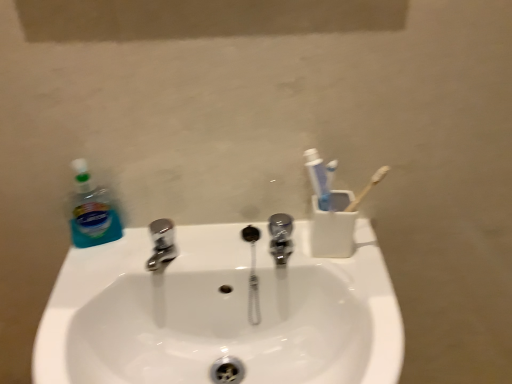
Question: Can you confirm if white plastic toothbrush holder at upper right is shorter than polished chrome tap at center?

Choices:
 (A) yes
 (B) no

Answer: (B)

Question: Does white plastic toothbrush holder at upper right contain polished chrome tap at center?

Choices:
 (A) no
 (B) yes

Answer: (A)

Question: Would you consider white plastic toothbrush holder at upper right to be distant from polished chrome tap at center?

Choices:
 (A) yes
 (B) no

Answer: (B)

Question: From the image's perspective, is white plastic toothbrush holder at upper right on polished chrome tap at center?

Choices:
 (A) yes
 (B) no

Answer: (A)

Question: Is white plastic toothbrush holder at upper right oriented away from polished chrome tap at center?

Choices:
 (A) yes
 (B) no

Answer: (B)

Question: Considering the positions of polished chrome tap at center and white glossy sink at center in the image, is polished chrome tap at center wider or thinner than white glossy sink at center?

Choices:
 (A) thin
 (B) wide

Answer: (A)

Question: Visually, is polished chrome tap at center positioned to the left or to the right of white glossy sink at center?

Choices:
 (A) left
 (B) right

Answer: (B)

Question: Is polished chrome tap at center in front of or behind white glossy sink at center in the image?

Choices:
 (A) behind
 (B) front

Answer: (A)

Question: From a real-world perspective, is polished chrome tap at center physically located above or below white glossy sink at center?

Choices:
 (A) below
 (B) above

Answer: (B)

Question: From the image's perspective, is white plastic toothbrush holder at upper right above or below polished chrome tap at center?

Choices:
 (A) below
 (B) above

Answer: (B)

Question: Does point (317, 221) appear closer or farther from the camera than point (288, 243)?

Choices:
 (A) closer
 (B) farther

Answer: (A)

Question: Is white plastic toothbrush holder at upper right spatially inside polished chrome tap at center, or outside of it?

Choices:
 (A) inside
 (B) outside

Answer: (B)

Question: Would you say white plastic toothbrush holder at upper right is to the left or to the right of polished chrome tap at center in the picture?

Choices:
 (A) left
 (B) right

Answer: (B)

Question: From the image's perspective, is white glossy sink at center above or below white plastic toothbrush holder at upper right?

Choices:
 (A) above
 (B) below

Answer: (B)

Question: From a real-world perspective, relative to white plastic toothbrush holder at upper right, is white glossy sink at center vertically above or below?

Choices:
 (A) below
 (B) above

Answer: (A)